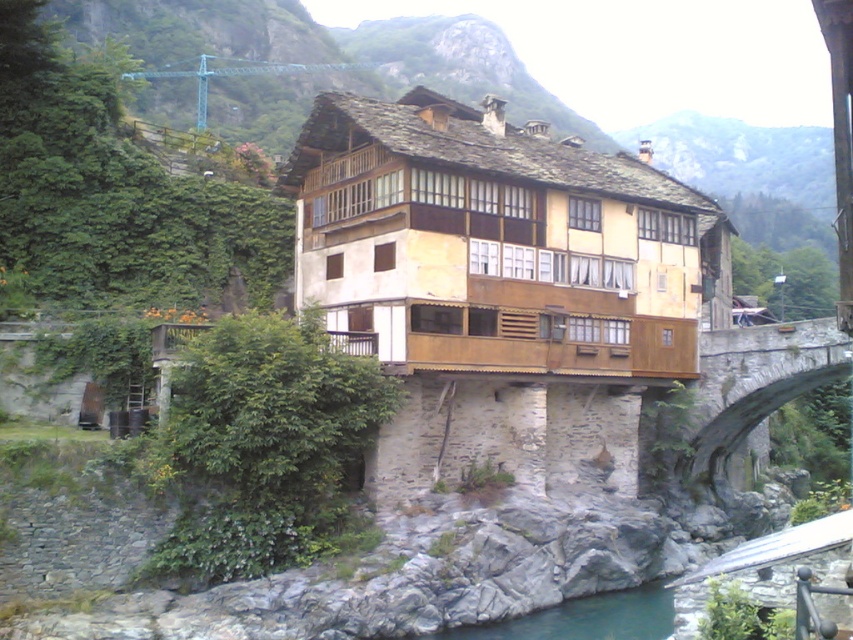
Is point (796, 352) closer to camera compared to point (563, 637)?

No, it is behind (563, 637).

Where is `stone arch bridge at right`? This screenshot has width=853, height=640. stone arch bridge at right is located at coordinates (756, 381).